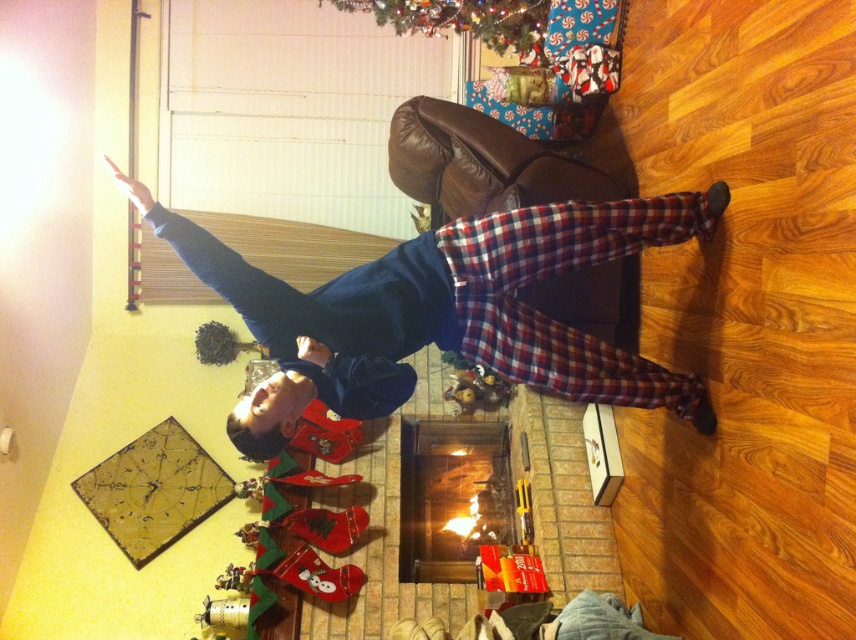
Does brick fireplace at center have a larger size compared to green matte christmas tree at upper center?

Indeed, brick fireplace at center has a larger size compared to green matte christmas tree at upper center.

Which is above, brick fireplace at center or green matte christmas tree at upper center?

green matte christmas tree at upper center is higher up.

Does point (498, 433) come behind point (500, 28)?

Yes, point (498, 433) is behind point (500, 28).

Where is `brick fireplace at center`? The image size is (856, 640). brick fireplace at center is located at coordinates (450, 496).

You are a GUI agent. You are given a task and a screenshot of the screen. Output one action in this format:
    pyautogui.click(x=<x>, y=<y>)
    Task: Click on the plaid fabric pants at center
    
    Given the screenshot: What is the action you would take?
    pyautogui.click(x=444, y=310)

Locate an element on the screen. The height and width of the screenshot is (640, 856). plaid fabric pants at center is located at coordinates (444, 310).

Which of these two, plaid fabric pants at center or green matte christmas tree at upper center, stands shorter?

green matte christmas tree at upper center

Find the location of a particular element. The width and height of the screenshot is (856, 640). plaid fabric pants at center is located at coordinates (444, 310).